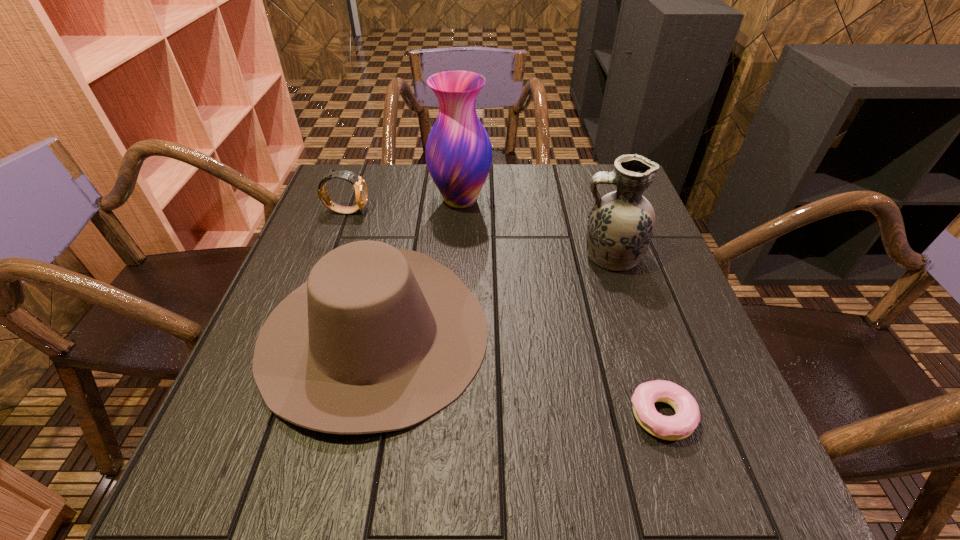
At what (x,y) coordinates should I click in order to perform the action: click on vacant area in the image that satisfies the following two spatial constraints: 1. on the face of the watch; 2. with the handle on the side of the fourth shortest object. Please return your answer as a coordinate pair (x, y). Looking at the image, I should click on click(330, 256).

The width and height of the screenshot is (960, 540). I want to click on free point that satisfies the following two spatial constraints: 1. on the face of the third shortest object; 2. on the right side of the watch, so click(x=301, y=333).

You are a GUI agent. You are given a task and a screenshot of the screen. Output one action in this format:
    pyautogui.click(x=<x>, y=<y>)
    Task: Click on the vacant point that satisfies the following two spatial constraints: 1. on the face of the fourth tallest object; 2. with the handle on the side of the nearer vase
    Image resolution: width=960 pixels, height=540 pixels.
    Given the screenshot: What is the action you would take?
    pyautogui.click(x=330, y=256)

The image size is (960, 540). Identify the location of blank area in the image that satisfies the following two spatial constraints: 1. on the face of the second shortest object; 2. on the right side of the doughnut. (271, 415).

Where is `blank space that satisfies the following two spatial constraints: 1. on the face of the watch; 2. on the left side of the third shortest object`? This screenshot has width=960, height=540. blank space that satisfies the following two spatial constraints: 1. on the face of the watch; 2. on the left side of the third shortest object is located at coordinates (301, 333).

Identify the location of vacant region that satisfies the following two spatial constraints: 1. on the face of the third shortest object; 2. on the right side of the second shortest object. The image size is (960, 540). (301, 333).